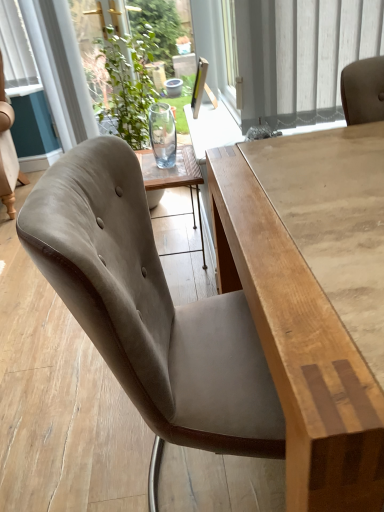
Question: From the image's perspective, does transparent glass vase at upper center appear higher than suede-like beige chair at center?

Choices:
 (A) yes
 (B) no

Answer: (A)

Question: Does transparent glass vase at upper center come behind suede-like beige chair at center?

Choices:
 (A) yes
 (B) no

Answer: (A)

Question: Is transparent glass vase at upper center bigger than suede-like beige chair at center?

Choices:
 (A) yes
 (B) no

Answer: (B)

Question: Can we say transparent glass vase at upper center lies outside suede-like beige chair at center?

Choices:
 (A) yes
 (B) no

Answer: (A)

Question: Can you confirm if transparent glass vase at upper center is positioned to the left of suede-like beige chair at center?

Choices:
 (A) no
 (B) yes

Answer: (A)

Question: Does transparent glass vase at upper center have a smaller size compared to suede-like beige chair at center?

Choices:
 (A) yes
 (B) no

Answer: (A)

Question: Is light brown wood table at center thinner than suede-like beige chair at center?

Choices:
 (A) no
 (B) yes

Answer: (B)

Question: From a real-world perspective, is light brown wood table at center physically above suede-like beige chair at center?

Choices:
 (A) yes
 (B) no

Answer: (A)

Question: From the image's perspective, would you say light brown wood table at center is positioned over suede-like beige chair at center?

Choices:
 (A) yes
 (B) no

Answer: (B)

Question: Is light brown wood table at center positioned far away from suede-like beige chair at center?

Choices:
 (A) yes
 (B) no

Answer: (B)

Question: Considering the relative sizes of light brown wood table at center and suede-like beige chair at center in the image provided, is light brown wood table at center taller than suede-like beige chair at center?

Choices:
 (A) yes
 (B) no

Answer: (A)

Question: Can suede-like beige chair at center be found inside light brown wood table at center?

Choices:
 (A) yes
 (B) no

Answer: (B)

Question: Does suede-like beige chair at center have a lesser width compared to light brown wood table at center?

Choices:
 (A) no
 (B) yes

Answer: (A)